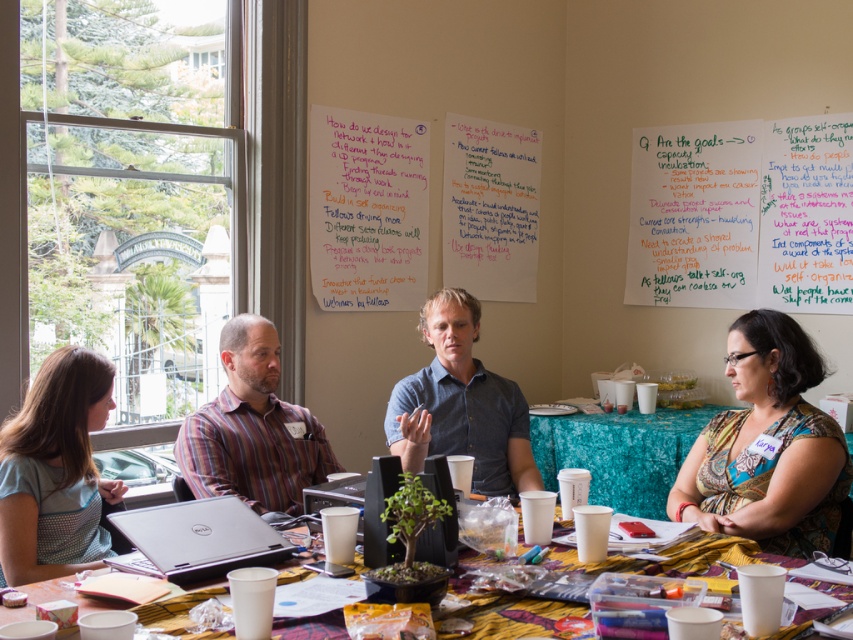
You are part of the group in the image and want to pass a pen from the patterned fabric shirt at lower right to the light blue cotton shirt at lower left. Which direction should you pass it?

The patterned fabric shirt at lower right is positioned on the right side of the light blue cotton shirt at lower left, so you should pass the pen to the left.

You are a photographer trying to capture a group photo of the brainstorming session. You want to ensure that both the patterned fabric shirt at lower right and the blue denim shirt at center are clearly visible in the photo. Given their sizes, which shirt should you focus on to ensure it doesn

The patterned fabric shirt at lower right has a smaller size compared to blue denim shirt at center. To ensure both are clearly visible, focus on the blue denim shirt at center first since it is larger and easier to capture details, then adjust the framing to include the smaller patterned fabric shirt at lower right.